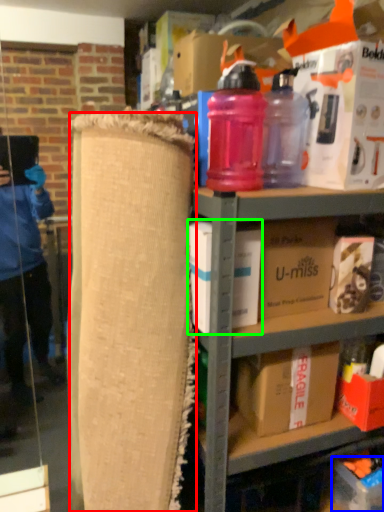
Question: Which object is the farthest from plywood (highlighted by a red box)? Choose among these: cardboard box (highlighted by a blue box) or box (highlighted by a green box).

Choices:
 (A) cardboard box
 (B) box

Answer: (A)